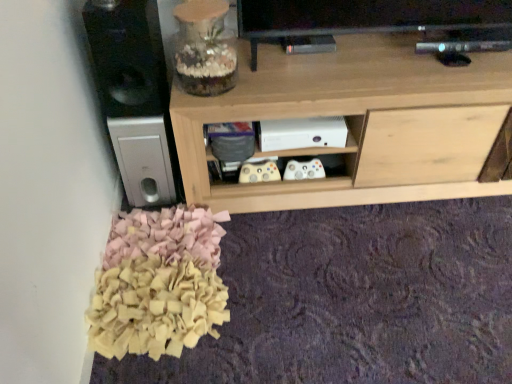
Question: Which is correct: light wood shelf at center is inside black matte speaker at left, or outside of it?

Choices:
 (A) inside
 (B) outside

Answer: (B)

Question: Considering their positions, is light wood shelf at center located in front of or behind black matte speaker at left?

Choices:
 (A) behind
 (B) front

Answer: (A)

Question: Considering the positions of light wood shelf at center and black matte speaker at left in the image, is light wood shelf at center wider or thinner than black matte speaker at left?

Choices:
 (A) thin
 (B) wide

Answer: (B)

Question: From the image's perspective, relative to light wood shelf at center, is black matte speaker at left above or below?

Choices:
 (A) below
 (B) above

Answer: (B)

Question: Looking at the image, does black matte speaker at left seem bigger or smaller compared to light wood shelf at center?

Choices:
 (A) big
 (B) small

Answer: (B)

Question: Is black matte speaker at left wider or thinner than light wood shelf at center?

Choices:
 (A) thin
 (B) wide

Answer: (A)

Question: From a real-world perspective, is black matte speaker at left physically located above or below light wood shelf at center?

Choices:
 (A) below
 (B) above

Answer: (B)